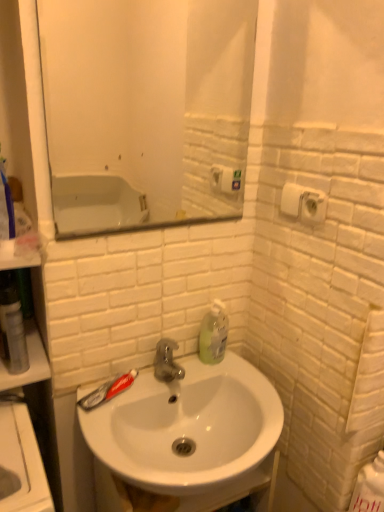
Question: Considering the relative positions of white glossy sink at center and white matte toilet paper at upper right in the image provided, is white glossy sink at center to the left or to the right of white matte toilet paper at upper right?

Choices:
 (A) left
 (B) right

Answer: (A)

Question: From a real-world perspective, is white glossy sink at center above or below white matte toilet paper at upper right?

Choices:
 (A) below
 (B) above

Answer: (A)

Question: Which object is the closest to the white glossy mirror at upper center?

Choices:
 (A) transparent plastic mouthwash at left
 (B) translucent plastic toothpaste at sink left
 (C) white matte toilet paper at upper right
 (D) translucent plastic soap dispenser at upper right
 (E) white glossy sink at center

Answer: (E)

Question: Which of these objects is positioned farthest from the translucent plastic soap dispenser at upper right?

Choices:
 (A) translucent plastic toothpaste at sink left
 (B) white matte toilet paper at upper right
 (C) white glossy sink at center
 (D) white glossy mirror at upper center
 (E) transparent plastic mouthwash at left

Answer: (D)